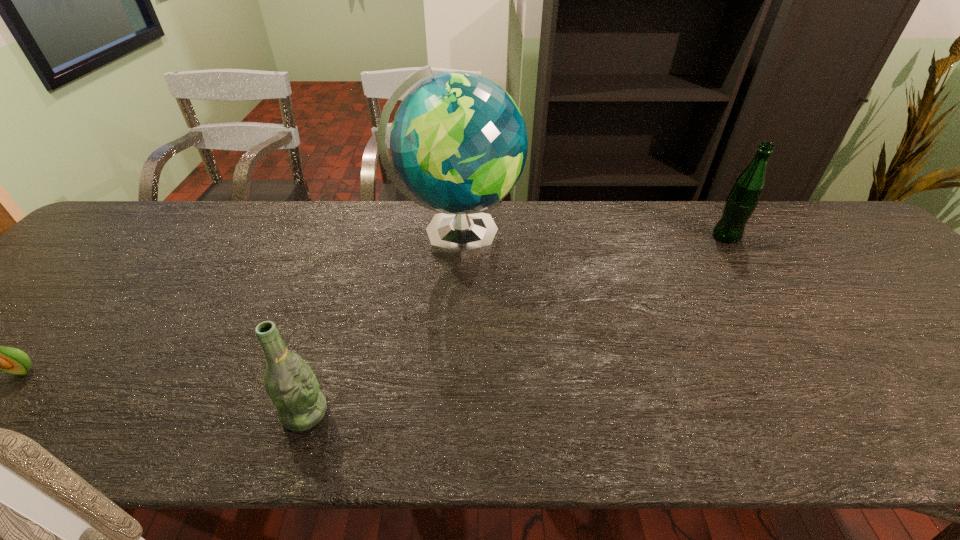
What are the coordinates of `free space between the third object from left to right and the left beer bottle` in the screenshot? It's located at (381, 325).

The height and width of the screenshot is (540, 960). In order to click on object that is the second closest one to the avocado in this screenshot , I will do `click(458, 142)`.

The height and width of the screenshot is (540, 960). What are the coordinates of `the third closest object to the third farthest object` in the screenshot? It's located at (741, 202).